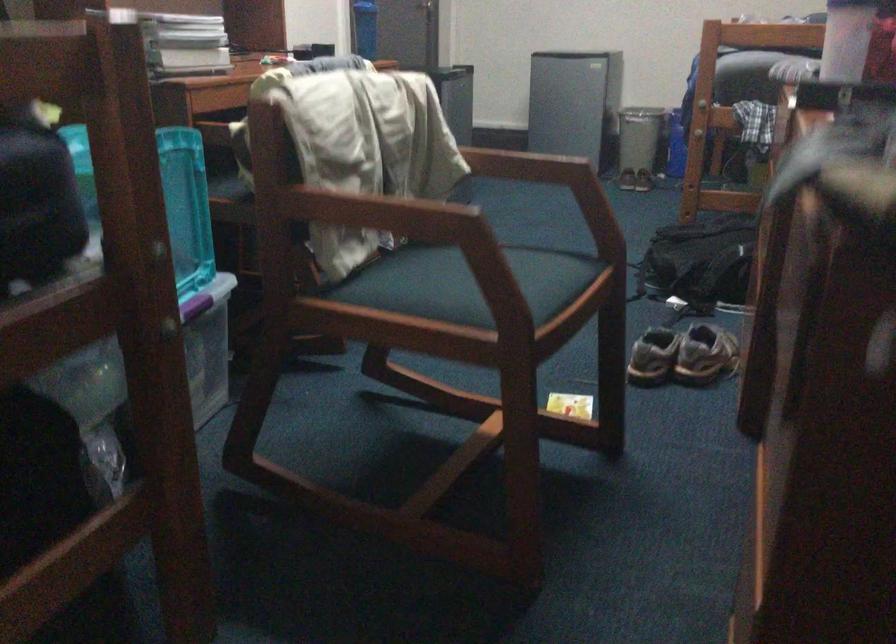
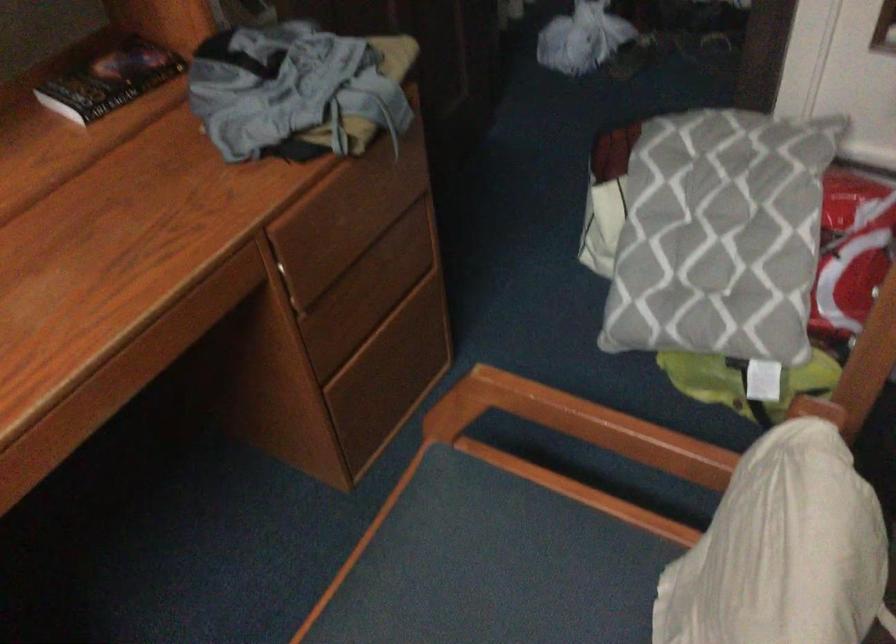
The point at (458, 304) is marked in the first image. Where is the corresponding point in the second image?

(549, 580)